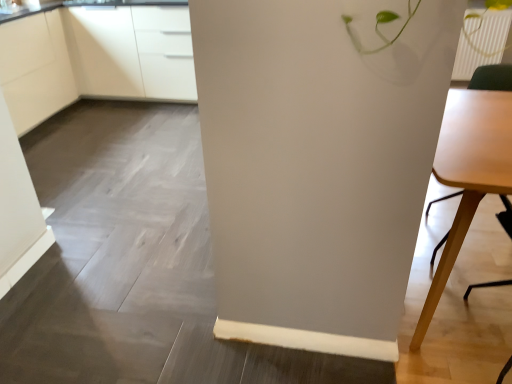
What do you see at coordinates (468, 172) in the screenshot? The width and height of the screenshot is (512, 384). I see `light wood table at right` at bounding box center [468, 172].

The image size is (512, 384). I want to click on light wood table at right, so click(468, 172).

What do you see at coordinates (94, 59) in the screenshot? The height and width of the screenshot is (384, 512). I see `white glossy cabinets at upper left, which is the 2th cabinetry in left-to-right order` at bounding box center [94, 59].

What do you see at coordinates (35, 69) in the screenshot?
I see `white matte cabinet at upper left, marked as the 1th cabinetry in a left-to-right arrangement` at bounding box center [35, 69].

What are the coordinates of `white matte cabinet at upper left, marked as the 1th cabinetry in a left-to-right arrangement` in the screenshot? It's located at (35, 69).

Identify the location of light wood table at right. This screenshot has height=384, width=512. (468, 172).

Is light wood table at right inside white glossy cabinets at upper left, which is the 2th cabinetry in left-to-right order?

That's incorrect, light wood table at right is not inside white glossy cabinets at upper left, which is the 2th cabinetry in left-to-right order.

Is white glossy cabinets at upper left, which is the first cabinetry in right-to-left order, turned away from light wood table at right?

No, white glossy cabinets at upper left, which is the first cabinetry in right-to-left order, is not facing away from light wood table at right.

You are a GUI agent. You are given a task and a screenshot of the screen. Output one action in this format:
    pyautogui.click(x=<x>, y=<y>)
    Task: Click on the 2nd cabinetry behind the light wood table at right
    
    Given the screenshot: What is the action you would take?
    tap(94, 59)

Considering the sizes of white glossy cabinets at upper left, which is the 2th cabinetry in left-to-right order, and light wood table at right in the image, is white glossy cabinets at upper left, which is the 2th cabinetry in left-to-right order, wider or thinner than light wood table at right?

Clearly, white glossy cabinets at upper left, which is the 2th cabinetry in left-to-right order, has less width compared to light wood table at right.

Between white matte cabinet at upper left, marked as the second cabinetry in a right-to-left arrangement, and light wood table at right, which one is positioned behind?

white matte cabinet at upper left, marked as the second cabinetry in a right-to-left arrangement, is more distant.

Is white matte cabinet at upper left, marked as the 1th cabinetry in a left-to-right arrangement, not close to light wood table at right?

white matte cabinet at upper left, marked as the 1th cabinetry in a left-to-right arrangement, is positioned a significant distance from light wood table at right.

Considering the positions of objects white matte cabinet at upper left, marked as the second cabinetry in a right-to-left arrangement, and light wood table at right in the image provided, who is more to the left, white matte cabinet at upper left, marked as the second cabinetry in a right-to-left arrangement, or light wood table at right?

white matte cabinet at upper left, marked as the second cabinetry in a right-to-left arrangement.

Could you tell me if white matte cabinet at upper left, marked as the 1th cabinetry in a left-to-right arrangement, is facing light wood table at right?

Yes, white matte cabinet at upper left, marked as the 1th cabinetry in a left-to-right arrangement, is turned towards light wood table at right.

Is light wood table at right bigger than white glossy cabinets at upper left, which is the 2th cabinetry in left-to-right order?

No.

Considering the relative sizes of light wood table at right and white glossy cabinets at upper left, which is the first cabinetry in right-to-left order, in the image provided, is light wood table at right shorter than white glossy cabinets at upper left, which is the first cabinetry in right-to-left order,?

Yes, light wood table at right is shorter than white glossy cabinets at upper left, which is the first cabinetry in right-to-left order.

From a real-world perspective, is light wood table at right above or below white glossy cabinets at upper left, which is the first cabinetry in right-to-left order?

From a real-world perspective, light wood table at right is physically below white glossy cabinets at upper left, which is the first cabinetry in right-to-left order.

Is the position of light wood table at right more distant than that of white glossy cabinets at upper left, which is the first cabinetry in right-to-left order?

No, it is not.

How different are the orientations of light wood table at right and white matte cabinet at upper left, marked as the 1th cabinetry in a left-to-right arrangement, in degrees?

90.2 degrees.

In the scene shown: Who is shorter, light wood table at right or white matte cabinet at upper left, marked as the 1th cabinetry in a left-to-right arrangement?

light wood table at right.

Considering the positions of objects light wood table at right and white matte cabinet at upper left, marked as the 1th cabinetry in a left-to-right arrangement, in the image provided, who is more to the right, light wood table at right or white matte cabinet at upper left, marked as the 1th cabinetry in a left-to-right arrangement,?

light wood table at right.

Could you tell me if light wood table at right is turned towards white matte cabinet at upper left, marked as the second cabinetry in a right-to-left arrangement?

No, light wood table at right is not aimed at white matte cabinet at upper left, marked as the second cabinetry in a right-to-left arrangement.

Is white glossy cabinets at upper left, which is the first cabinetry in right-to-left order, closer to the viewer compared to white matte cabinet at upper left, marked as the second cabinetry in a right-to-left arrangement?

That is False.

Between white glossy cabinets at upper left, which is the 2th cabinetry in left-to-right order, and white matte cabinet at upper left, marked as the second cabinetry in a right-to-left arrangement, which one has more height?

white matte cabinet at upper left, marked as the second cabinetry in a right-to-left arrangement, is taller.

Is white glossy cabinets at upper left, which is the first cabinetry in right-to-left order, to the right of white matte cabinet at upper left, marked as the second cabinetry in a right-to-left arrangement, from the viewer's perspective?

Yes.

Does point (97, 25) appear closer or farther from the camera than point (57, 20)?

Point (97, 25) appears to be farther away from the viewer than point (57, 20).

From the image's perspective, which object appears higher, white matte cabinet at upper left, marked as the 1th cabinetry in a left-to-right arrangement, or white glossy cabinets at upper left, which is the 2th cabinetry in left-to-right order?

white glossy cabinets at upper left, which is the 2th cabinetry in left-to-right order, appears higher in the image.

Considering the relative sizes of white matte cabinet at upper left, marked as the second cabinetry in a right-to-left arrangement, and white glossy cabinets at upper left, which is the 2th cabinetry in left-to-right order, in the image provided, is white matte cabinet at upper left, marked as the second cabinetry in a right-to-left arrangement, taller than white glossy cabinets at upper left, which is the 2th cabinetry in left-to-right order,?

Correct, white matte cabinet at upper left, marked as the second cabinetry in a right-to-left arrangement, is much taller as white glossy cabinets at upper left, which is the 2th cabinetry in left-to-right order.

Which is in front, point (58, 94) or point (63, 75)?

Positioned in front is point (58, 94).

Are white matte cabinet at upper left, marked as the 1th cabinetry in a left-to-right arrangement, and white glossy cabinets at upper left, which is the 2th cabinetry in left-to-right order, making contact?

No, white matte cabinet at upper left, marked as the 1th cabinetry in a left-to-right arrangement, is not with white glossy cabinets at upper left, which is the 2th cabinetry in left-to-right order.

Where is `table to the right of white glossy cabinets at upper left, which is the first cabinetry in right-to-left order`? table to the right of white glossy cabinets at upper left, which is the first cabinetry in right-to-left order is located at coordinates (468, 172).

The width and height of the screenshot is (512, 384). In order to click on table beneath the white matte cabinet at upper left, marked as the second cabinetry in a right-to-left arrangement (from a real-world perspective) in this screenshot , I will do `click(468, 172)`.

Which object lies further to the anchor point white matte cabinet at upper left, marked as the second cabinetry in a right-to-left arrangement, white glossy cabinets at upper left, which is the 2th cabinetry in left-to-right order, or light wood table at right?

light wood table at right lies further to white matte cabinet at upper left, marked as the second cabinetry in a right-to-left arrangement, than the other object.

Based on their spatial positions, is light wood table at right or white glossy cabinets at upper left, which is the first cabinetry in right-to-left order, further from white matte cabinet at upper left, marked as the second cabinetry in a right-to-left arrangement?

Based on the image, light wood table at right appears to be further to white matte cabinet at upper left, marked as the second cabinetry in a right-to-left arrangement.

From the image, which object appears to be nearer to light wood table at right, white glossy cabinets at upper left, which is the 2th cabinetry in left-to-right order, or white matte cabinet at upper left, marked as the 1th cabinetry in a left-to-right arrangement?

white glossy cabinets at upper left, which is the 2th cabinetry in left-to-right order, lies closer to light wood table at right than the other object.

Looking at this image, from the image, which object appears to be nearer to white glossy cabinets at upper left, which is the first cabinetry in right-to-left order, white matte cabinet at upper left, marked as the 1th cabinetry in a left-to-right arrangement, or light wood table at right?

white matte cabinet at upper left, marked as the 1th cabinetry in a left-to-right arrangement, is positioned closer to the anchor white glossy cabinets at upper left, which is the first cabinetry in right-to-left order.

Considering their positions, is light wood table at right positioned closer to white glossy cabinets at upper left, which is the first cabinetry in right-to-left order, than white matte cabinet at upper left, marked as the second cabinetry in a right-to-left arrangement?

white matte cabinet at upper left, marked as the second cabinetry in a right-to-left arrangement, lies closer to white glossy cabinets at upper left, which is the first cabinetry in right-to-left order, than the other object.

Considering their positions, is white matte cabinet at upper left, marked as the second cabinetry in a right-to-left arrangement, positioned further to light wood table at right than white glossy cabinets at upper left, which is the 2th cabinetry in left-to-right order?

white matte cabinet at upper left, marked as the second cabinetry in a right-to-left arrangement, is positioned further to the anchor light wood table at right.

Locate an element on the screen. Image resolution: width=512 pixels, height=384 pixels. cabinetry located between white matte cabinet at upper left, marked as the 1th cabinetry in a left-to-right arrangement, and light wood table at right in the left-right direction is located at coordinates (94, 59).